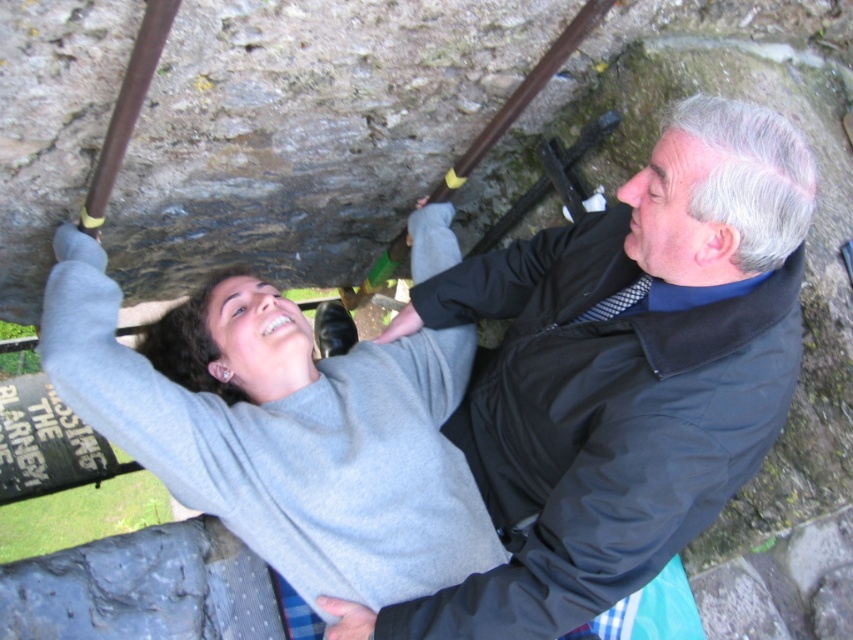
You are standing in front of the stone structure and want to place a small flag at the point closer to you. Which point should you choose between point (675, 548) and point (328, 480)?

Point (675, 548) is closer to the viewer than point (328, 480), so you should choose point (675, 548) to place the small flag.

You are a photographer trying to capture a group photo of the black smooth jacket at upper right and the gray matte sweater at upper center. Based on their current positions, which one should you ask to move to the left to ensure both are centered in the frame?

The black smooth jacket at upper right should move to the left since it is currently positioned on the right side of the gray matte sweater at upper center, so shifting it left would help center both in the frame.

Based on the photo, you are a photographer trying to capture a photo of the black smooth jacket at upper right and the gray matte sweater at upper center. Since you want to focus on the wider object, which one should you zoom in on?

The gray matte sweater at upper center is wider than the black smooth jacket at upper right, so you should zoom in on the gray matte sweater at upper center to focus on the wider object.